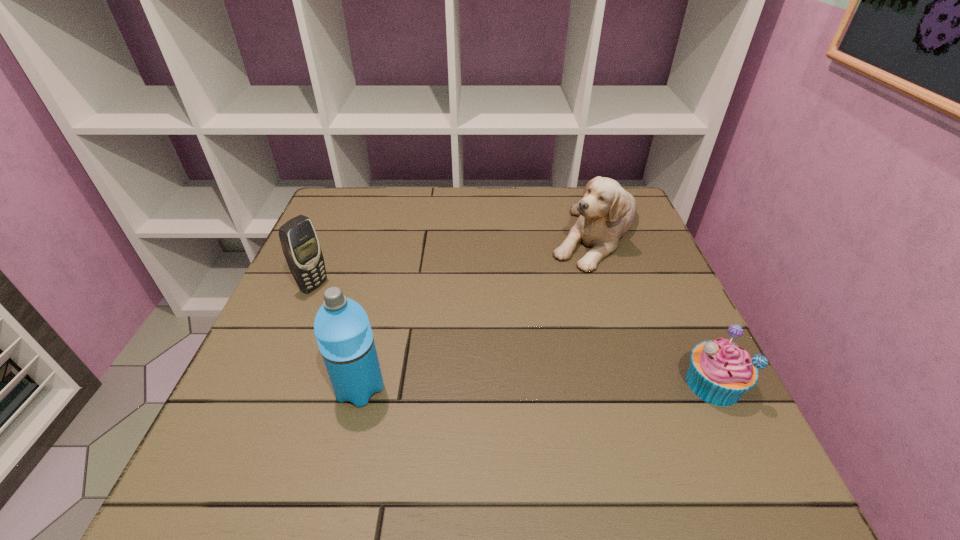
Find the location of `the tallest object`. the tallest object is located at coordinates (342, 329).

Identify the location of thermos bottle. The width and height of the screenshot is (960, 540). (342, 329).

Find the location of a particular element. the shortest object is located at coordinates (720, 372).

At what (x,y) coordinates should I click in order to perform the action: click on the farthest object. Please return your answer as a coordinate pair (x, y). The image size is (960, 540). Looking at the image, I should click on pos(606,211).

The width and height of the screenshot is (960, 540). In order to click on the leftmost object in this screenshot , I will do `click(300, 244)`.

Locate an element on the screen. The height and width of the screenshot is (540, 960). the second farthest object is located at coordinates (300, 244).

Find the location of a particular element. Image resolution: width=960 pixels, height=540 pixels. free spot located 0.050m on the back of the third object from right to left is located at coordinates (370, 349).

At what (x,y) coordinates should I click in order to perform the action: click on free location located on the left of the shortest object. Please return your answer as a coordinate pair (x, y). This screenshot has width=960, height=540. Looking at the image, I should click on (489, 384).

Locate an element on the screen. The image size is (960, 540). vacant space situated on the front-facing side of the farthest object is located at coordinates (533, 391).

At what (x,y) coordinates should I click in order to perform the action: click on vacant space located 0.180m on the front-facing side of the farthest object. Please return your answer as a coordinate pair (x, y). The height and width of the screenshot is (540, 960). Looking at the image, I should click on (564, 319).